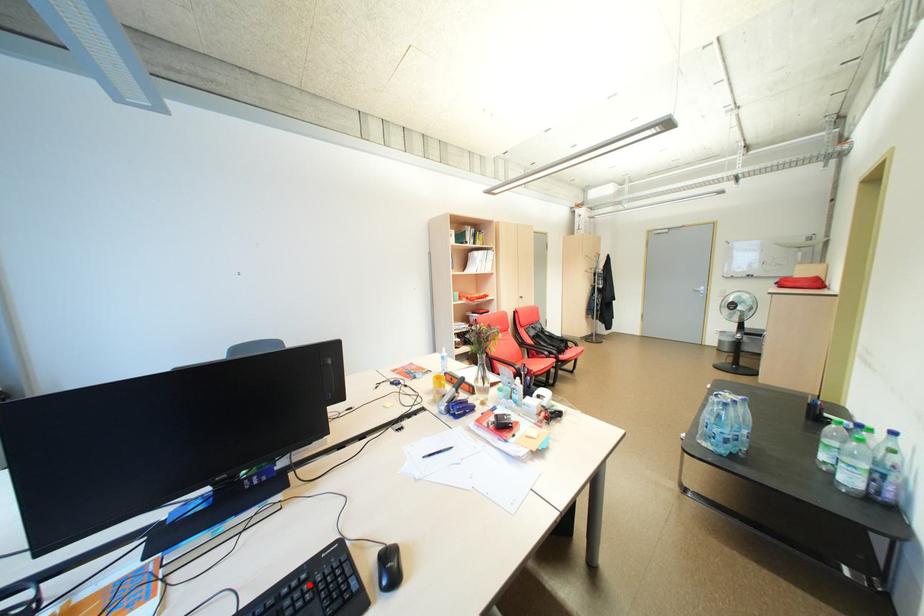
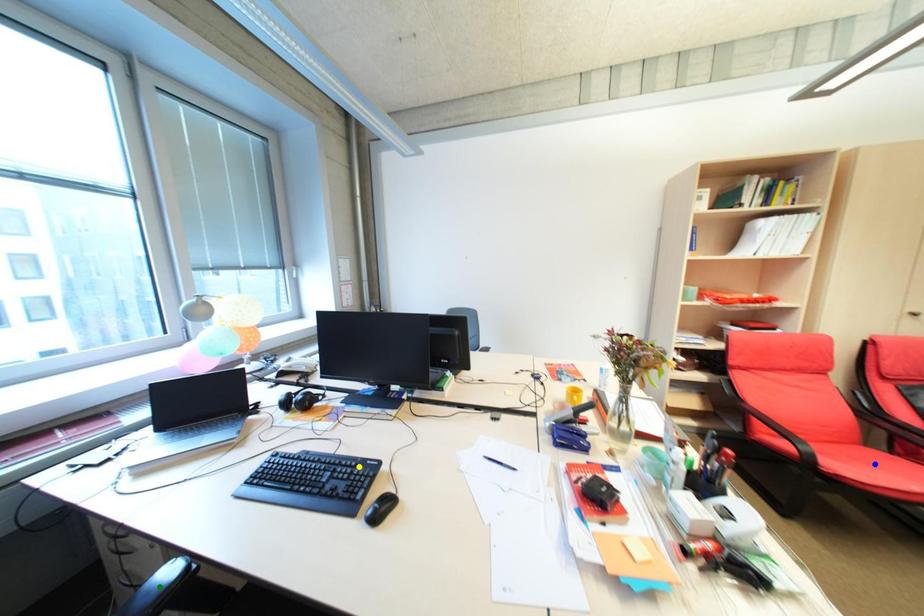
Question: I am providing you with two images of the same scene from different viewpoints. A red point is marked on the first image. You are given multiple points on the second image. Which mark in image 2 goes with the point in image 1?

Choices:
 (A) blue point
 (B) yellow point
 (C) green point

Answer: (B)